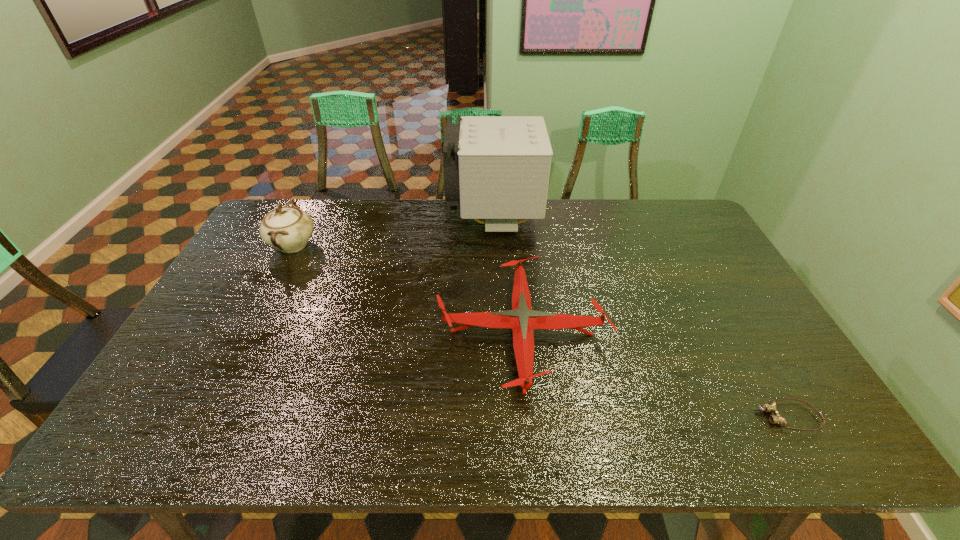
The height and width of the screenshot is (540, 960). What are the coordinates of `unoccupied area between the third tallest object and the chinaware` in the screenshot? It's located at (407, 289).

The width and height of the screenshot is (960, 540). I want to click on unoccupied position between the fan and the second shortest object, so click(x=507, y=277).

Find the location of a particular element. This screenshot has width=960, height=540. vacant area between the chinaware and the tallest object is located at coordinates click(393, 233).

Identify the location of free space that is in between the leftmost object and the fan. The image size is (960, 540). (393, 233).

Identify the location of object that stands as the closest to the rightmost object. (523, 320).

This screenshot has width=960, height=540. What are the coordinates of `object that is the second closest one to the rightmost object` in the screenshot? It's located at (497, 168).